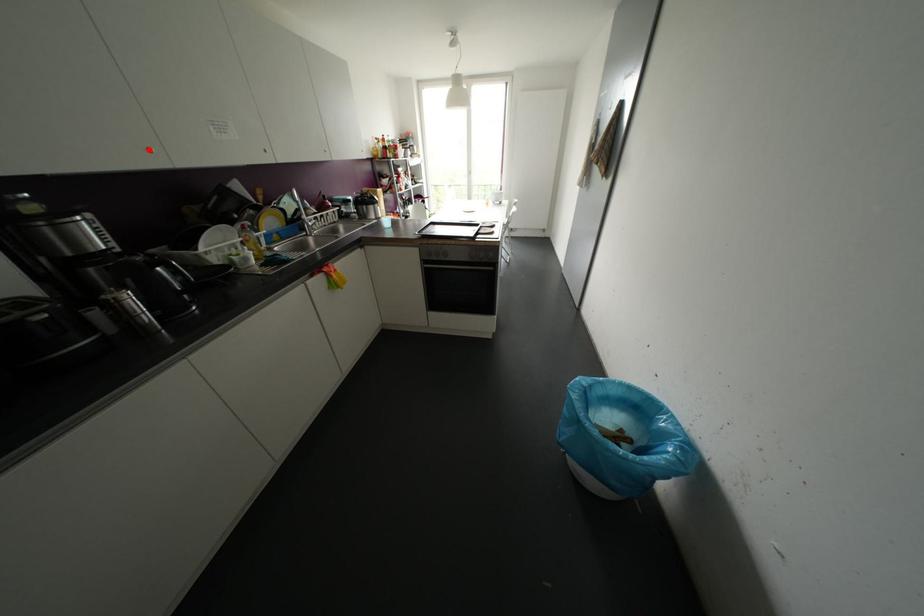
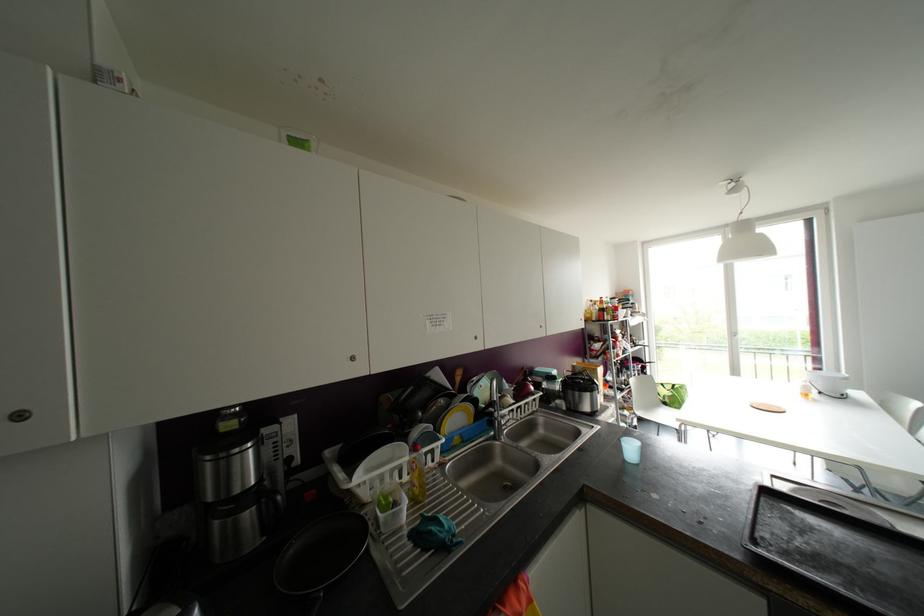
Where in the second image is the point corresponding to the highlighted location from the first image?

(351, 358)